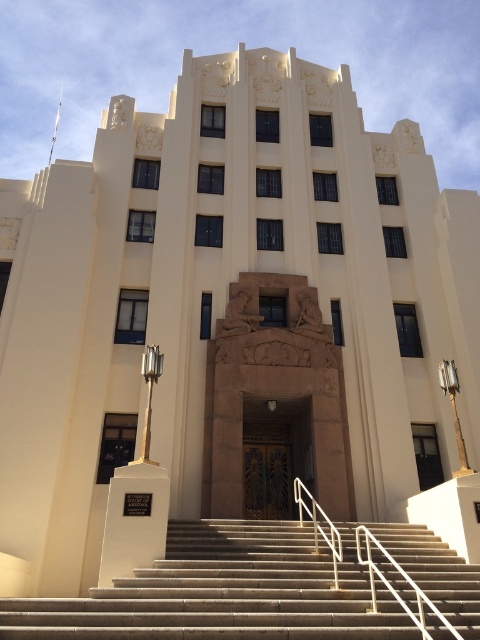
Question: Is concrete stairs at center thinner than brown wood door at center?

Choices:
 (A) yes
 (B) no

Answer: (B)

Question: Which object appears farthest from the camera in this image?

Choices:
 (A) brown wood door at center
 (B) concrete stairs at center
 (C) white marble monument at lower center

Answer: (A)

Question: Which of the following is the farthest from the observer?

Choices:
 (A) (291, 636)
 (B) (165, 528)

Answer: (B)

Question: Is the position of brown wood door at center less distant than that of white marble monument at lower center?

Choices:
 (A) yes
 (B) no

Answer: (B)

Question: Estimate the real-world distances between objects in this image. Which object is farther from the white marble monument at lower center?

Choices:
 (A) brown wood door at center
 (B) concrete stairs at center

Answer: (A)

Question: Can you confirm if concrete stairs at center is positioned to the left of white marble monument at lower center?

Choices:
 (A) no
 (B) yes

Answer: (A)